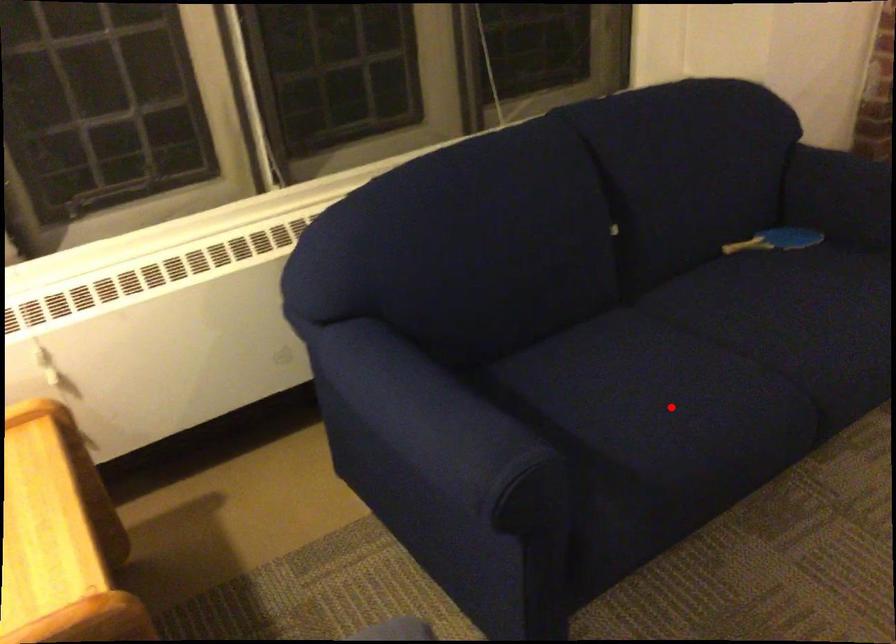
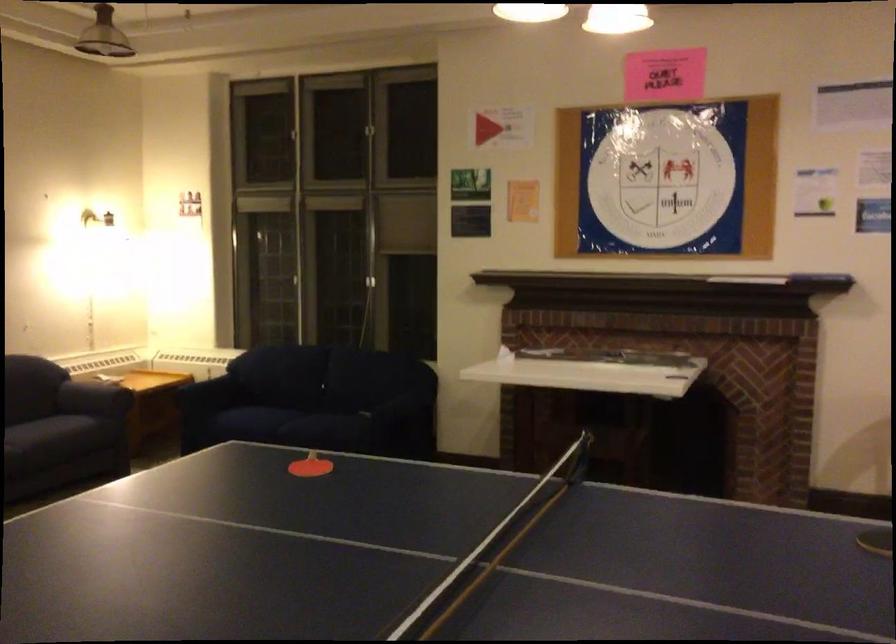
Question: I am providing you with two images of the same scene from different viewpoints. Given a red point in image1, look at the same physical point in image2. Is it:

Choices:
 (A) Closer to the viewpoint
 (B) Farther from the viewpoint

Answer: (B)